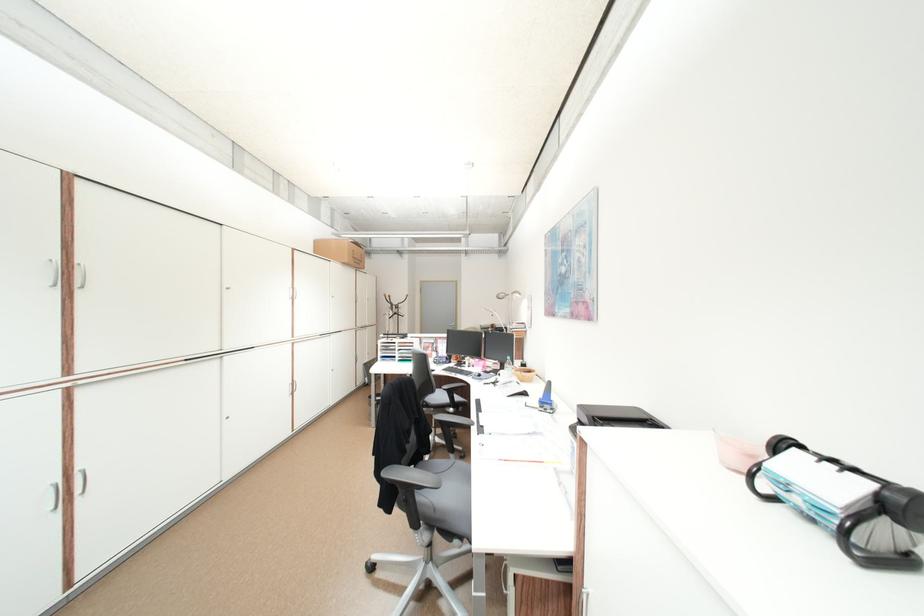
Find where to push the door handle. Please return your answer as a coordinate pair (x, y).

(55, 496)